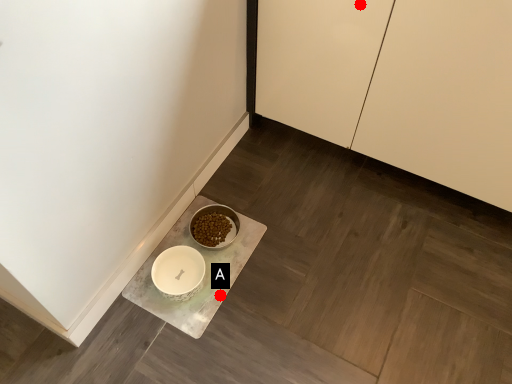
Question: Two points are circled on the image, labeled by A and B beside each circle. Which point is closer to the camera?

Choices:
 (A) A is closer
 (B) B is closer

Answer: (B)